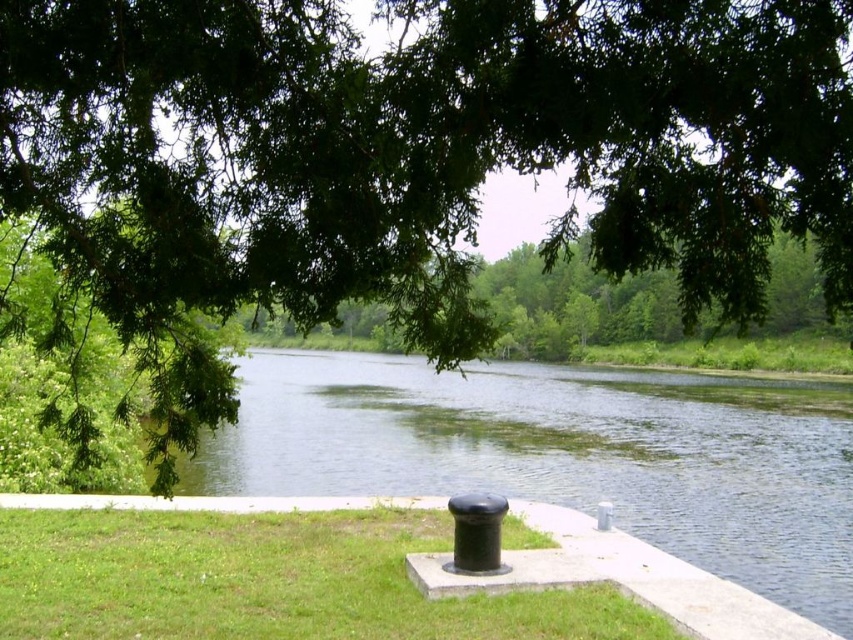
You are a landscape architect designing a new riverside park. You need to determine which area, the green water at center or the green grass at center, has a larger surface area for potential recreational activities. Based on the scene, which one would you choose?

The green water at center has a larger size compared to the green grass at center, so you should choose the green water at center for its larger surface area.